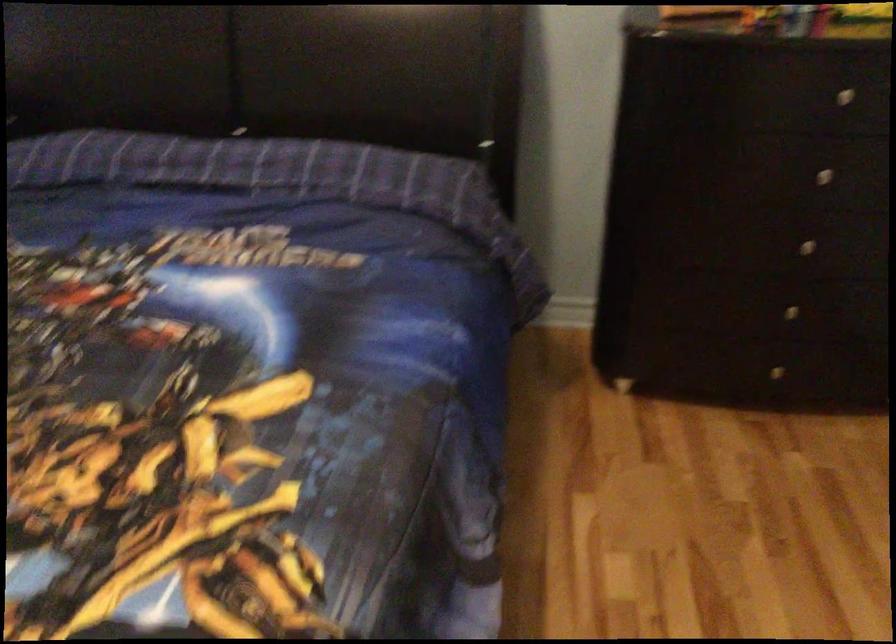
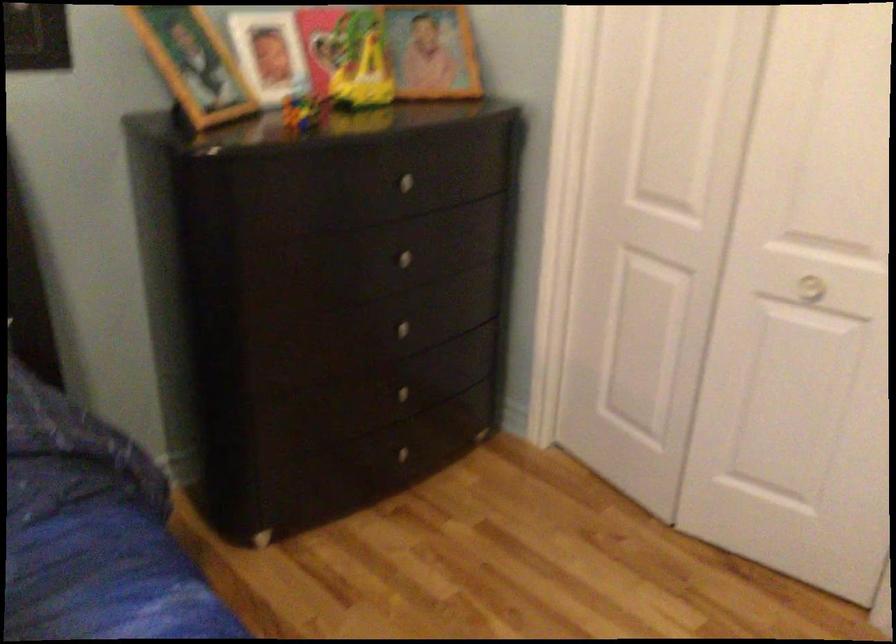
In the second image, find the point that corresponds to pixel 814 172 in the first image.

(399, 258)